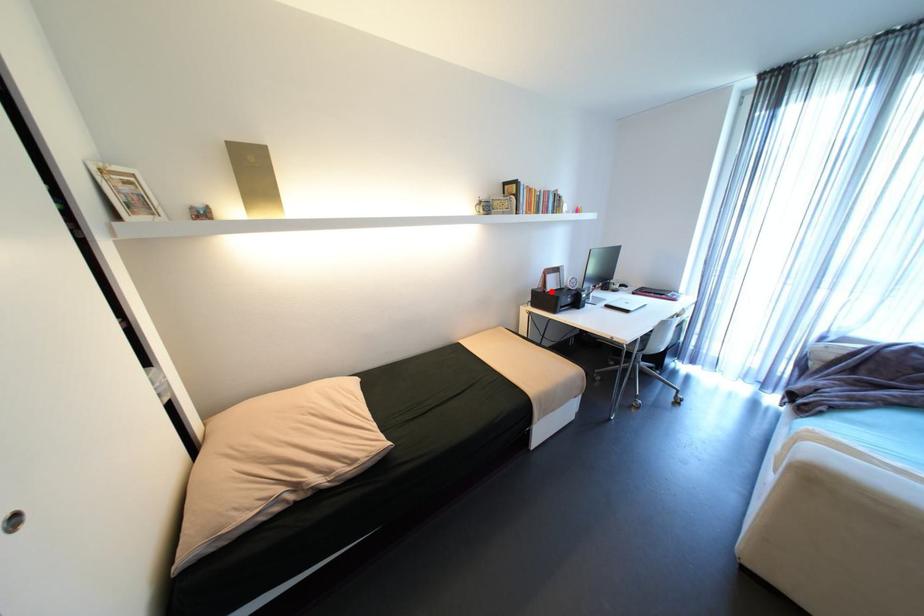
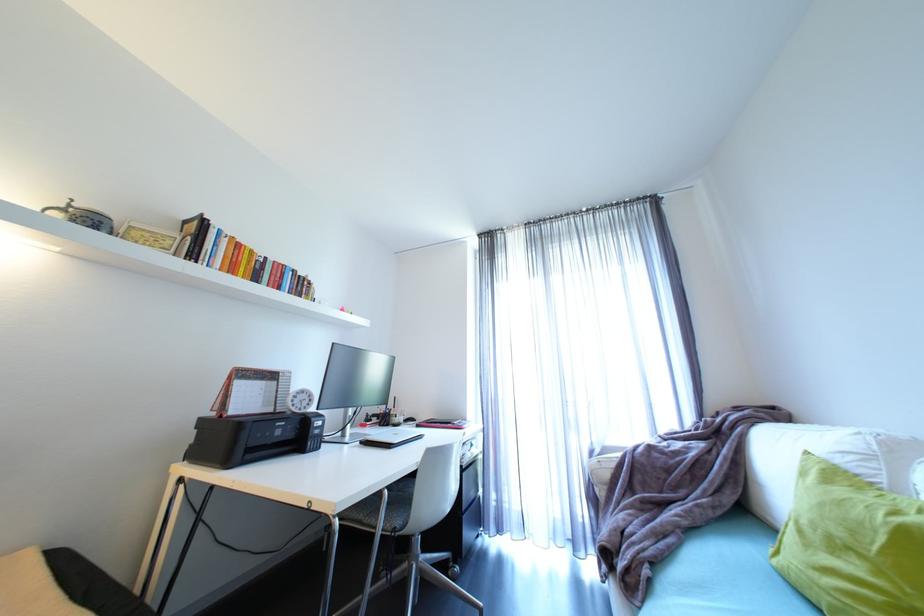
The point at the highlighted location is marked in the first image. Where is the corresponding point in the second image?

(228, 416)